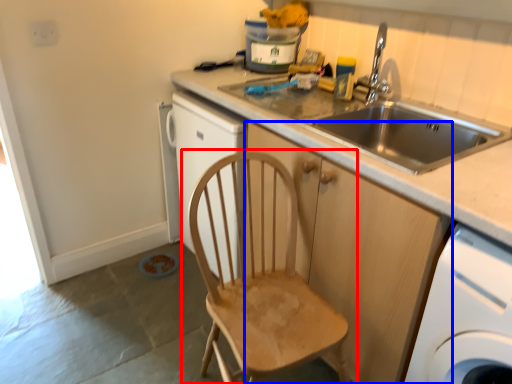
Question: Which of the following is the closest to the observer, chair (highlighted by a red box) or cabinetry (highlighted by a blue box)?

Choices:
 (A) chair
 (B) cabinetry

Answer: (A)